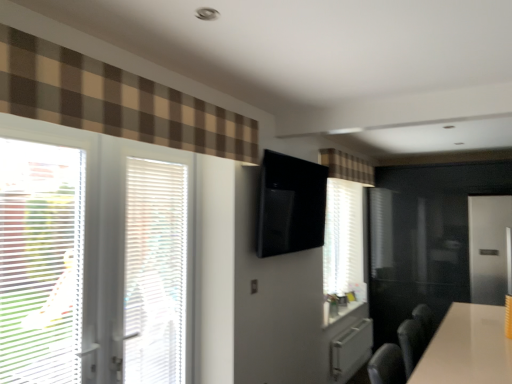
Question: Are brown checkered curtain at upper left, the first curtain positioned from the left, and white plastic blinds at left beside each other?

Choices:
 (A) yes
 (B) no

Answer: (B)

Question: Is white plastic blinds at left a part of brown checkered curtain at upper left, which is the 1th curtain in front-to-back order?

Choices:
 (A) yes
 (B) no

Answer: (B)

Question: From a real-world perspective, is brown checkered curtain at upper left, which is the second curtain from right to left, positioned over white plastic blinds at left based on gravity?

Choices:
 (A) yes
 (B) no

Answer: (A)

Question: Is white plastic blinds at left at the back of brown checkered curtain at upper left, which is the 1th curtain in front-to-back order?

Choices:
 (A) yes
 (B) no

Answer: (B)

Question: Does brown checkered curtain at upper left, which is the 1th curtain in front-to-back order, have a smaller size compared to white plastic blinds at left?

Choices:
 (A) no
 (B) yes

Answer: (A)

Question: Is satin silver screen door at right bigger or smaller than white textured blinds at left, which is counted as the second window, starting from the left?

Choices:
 (A) small
 (B) big

Answer: (B)

Question: From a real-world perspective, is satin silver screen door at right above or below white textured blinds at left, acting as the first window starting from the right?

Choices:
 (A) below
 (B) above

Answer: (A)

Question: In terms of height, does satin silver screen door at right look taller or shorter compared to white textured blinds at left, acting as the first window starting from the right?

Choices:
 (A) tall
 (B) short

Answer: (B)

Question: Visually, is satin silver screen door at right positioned to the left or to the right of white textured blinds at left, acting as the first window starting from the right?

Choices:
 (A) left
 (B) right

Answer: (B)

Question: Visually, is white glossy table at lower right positioned to the left or to the right of brown checkered curtain at upper left, the first curtain positioned from the left?

Choices:
 (A) left
 (B) right

Answer: (B)

Question: Is white glossy table at lower right wider or thinner than brown checkered curtain at upper left, the first curtain positioned from the left?

Choices:
 (A) wide
 (B) thin

Answer: (A)

Question: Considering their positions, is white glossy table at lower right located in front of or behind brown checkered curtain at upper left, which is the second curtain from right to left?

Choices:
 (A) front
 (B) behind

Answer: (B)

Question: Considering the positions of white glossy table at lower right and brown checkered curtain at upper left, acting as the 2th curtain starting from the back, in the image, is white glossy table at lower right bigger or smaller than brown checkered curtain at upper left, acting as the 2th curtain starting from the back,?

Choices:
 (A) small
 (B) big

Answer: (B)

Question: Is white plastic blinds at left inside or outside of white plastic blinds at left, marked as the second window in a right-to-left arrangement?

Choices:
 (A) outside
 (B) inside

Answer: (A)

Question: Is white plastic blinds at left in front of or behind white plastic blinds at left, which appears as the first window when viewed from the left, in the image?

Choices:
 (A) front
 (B) behind

Answer: (B)